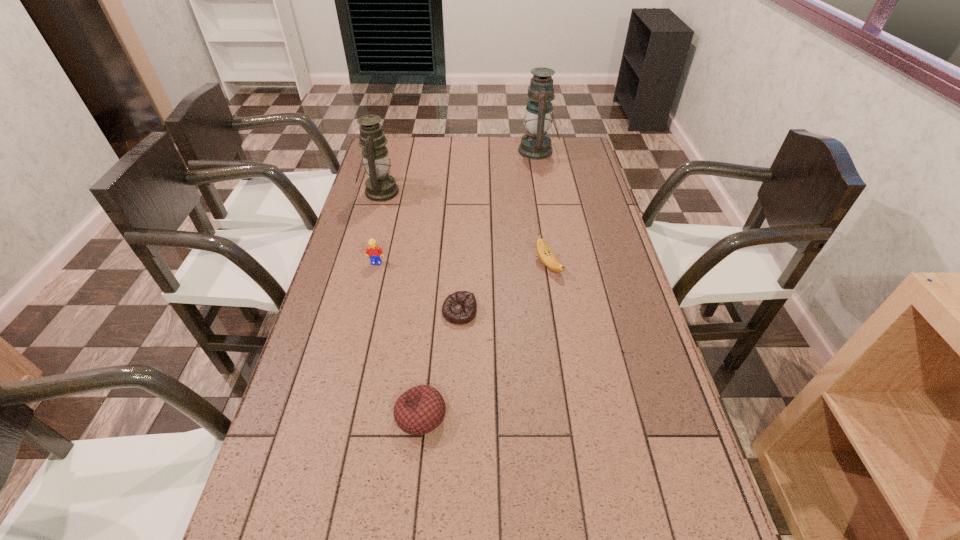
This screenshot has width=960, height=540. I want to click on object that is at the far right corner, so (x=536, y=145).

Where is `free space at the far edge of the desktop`? free space at the far edge of the desktop is located at coordinates (475, 148).

Find the location of a particular element. The image size is (960, 540). vacant space at the left edge is located at coordinates (344, 454).

The image size is (960, 540). In the image, there is a desktop. What are the coordinates of `vacant space at the right edge` in the screenshot? It's located at (628, 381).

This screenshot has height=540, width=960. In the image, there is a desktop. Find the location of `vacant space at the far right corner`. vacant space at the far right corner is located at coordinates (580, 142).

This screenshot has width=960, height=540. I want to click on empty space between the Lego and the banana, so click(463, 264).

Where is `free space between the shorter oil lamp and the shortest object`? free space between the shorter oil lamp and the shortest object is located at coordinates (420, 252).

Where is `vacant space that's between the farther oil lamp and the banana`? The width and height of the screenshot is (960, 540). vacant space that's between the farther oil lamp and the banana is located at coordinates (543, 208).

I want to click on vacant space that is in between the shortest object and the nearer beanbag, so click(440, 363).

In order to click on unoccupied position between the banana and the left oil lamp in this screenshot , I will do `click(465, 228)`.